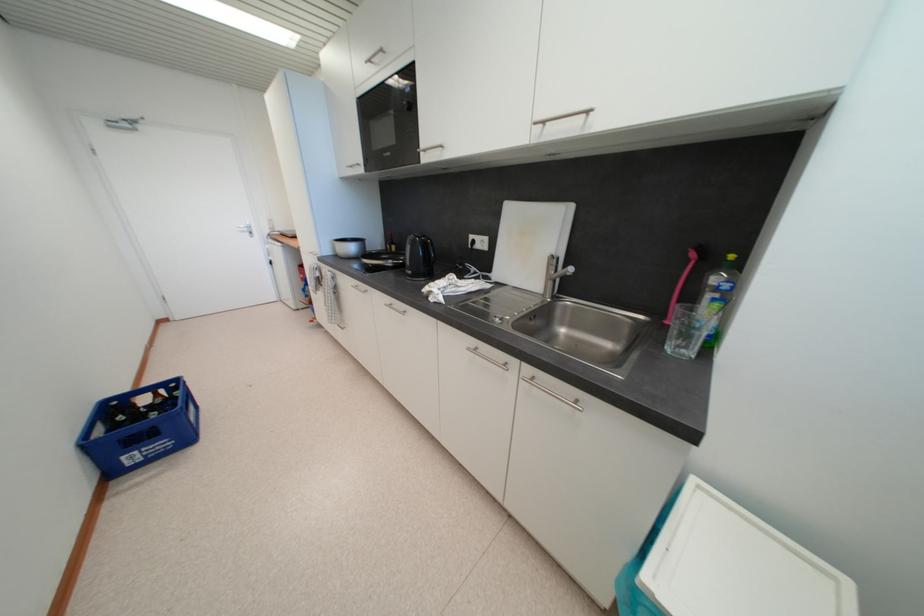
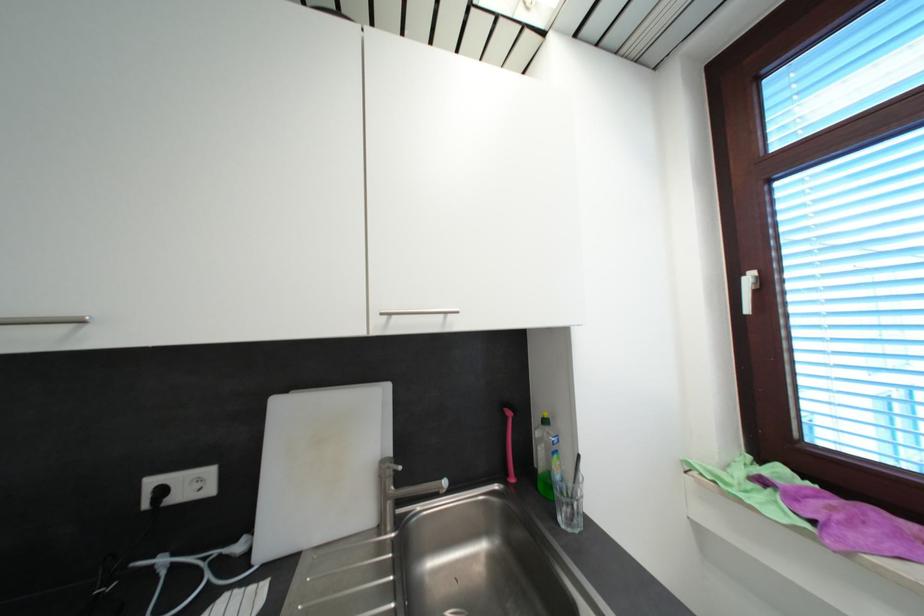
Where in the second image is the point corresponding to (550,126) from the first image?

(395, 315)